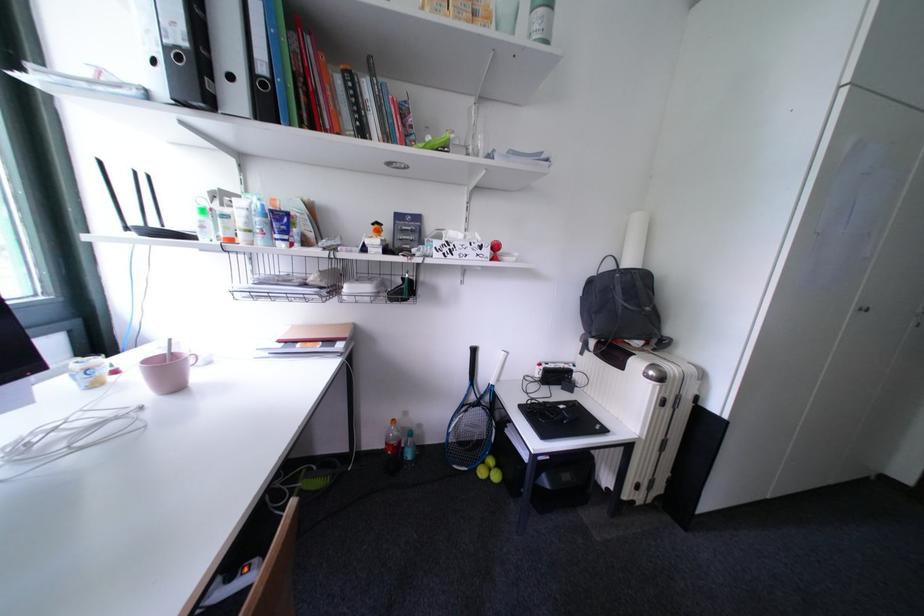
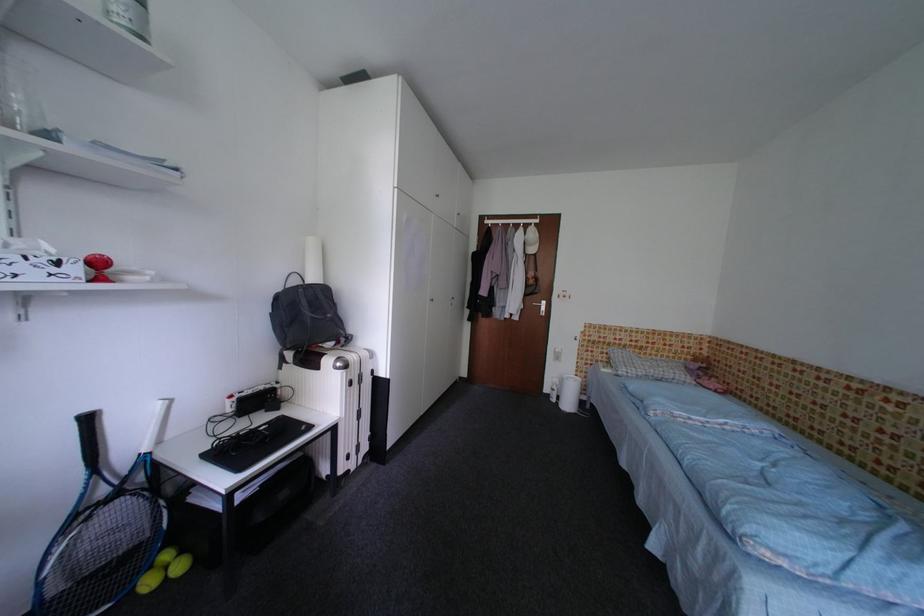
Find the pixel in the second image that matches point 599,285 in the first image.

(286, 301)